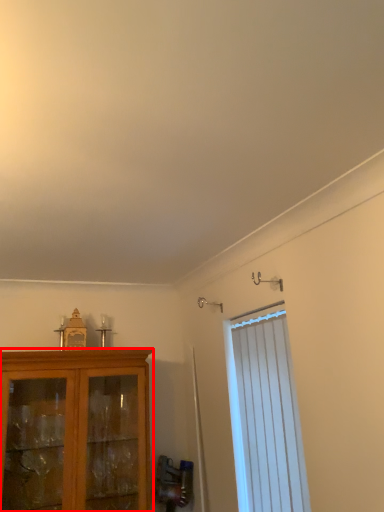
Question: From the image's perspective, considering the relative positions of cabinetry (annotated by the red box) and window in the image provided, where is cabinetry (annotated by the red box) located with respect to the staircase?

Choices:
 (A) above
 (B) below

Answer: (B)